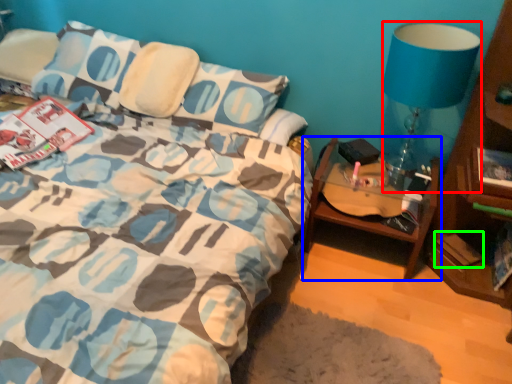
Question: Which is farther away from lamp (highlighted by a red box)? table (highlighted by a blue box) or paperback book (highlighted by a green box)?

Choices:
 (A) table
 (B) paperback book

Answer: (B)